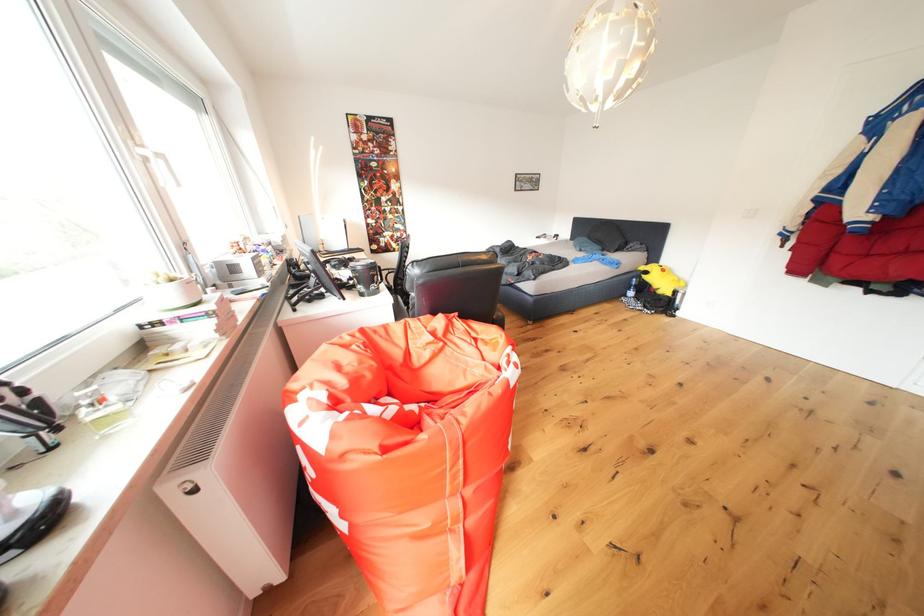
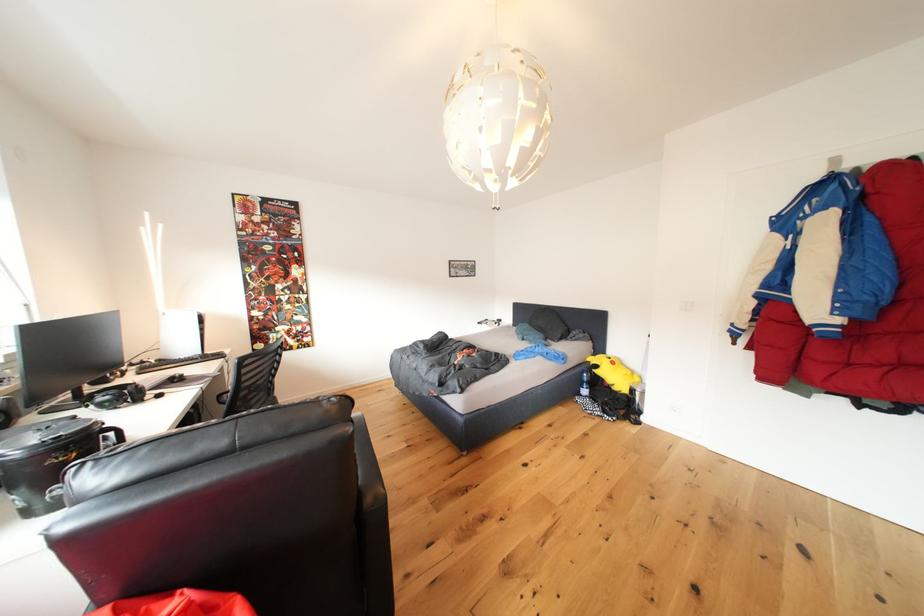
Question: Based on the continuous images, in which direction is the camera rotating? Reply with the corresponding letter.

Choices:
 (A) Left
 (B) Right
 (C) Up
 (D) Down

Answer: (C)